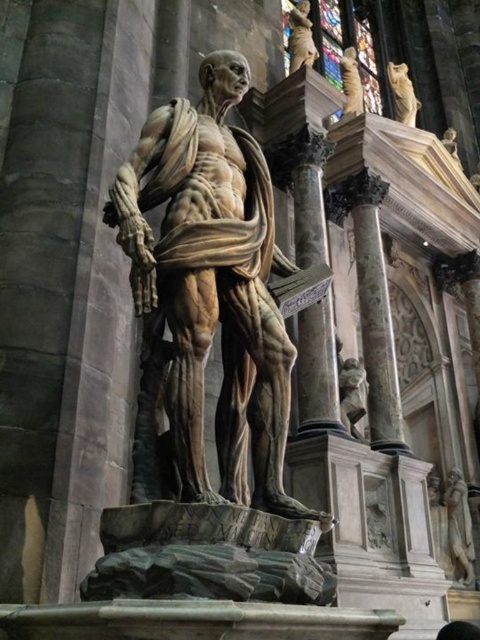
You are an art curator planning to move the polished bronze statue at right and the golden stone cat at upper right to a new exhibition space. The new space has a height limit of 1.5 meters. Given their sizes, which of the two objects might exceed the height limit?

The golden stone cat at upper right is larger than the polished bronze statue at right. Since the height limit is 1.5 meters, the golden stone cat at upper right might exceed the limit, while the polished bronze statue at right is smaller and likely within the limit.

You are an art student visiting the cathedral and want to sketch the polished marble statue at center and the golden stone cat at upper right. From your current position, which object should you focus on first to capture their relative positions accurately?

The polished marble statue at center is to the left of the golden stone cat at upper right, so you should sketch the polished marble statue at center first as it is positioned to the left side.